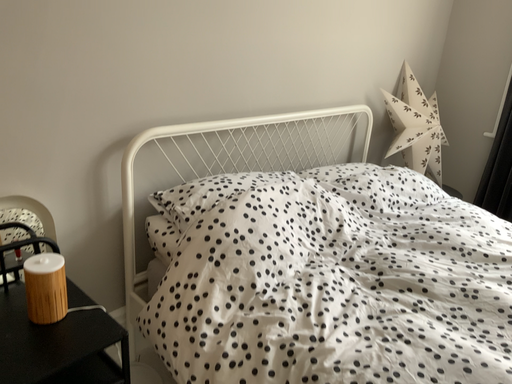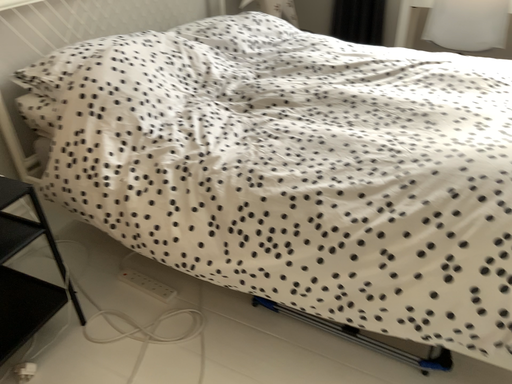
Question: Which way did the camera rotate in the video?

Choices:
 (A) rotated upward
 (B) rotated downward

Answer: (B)